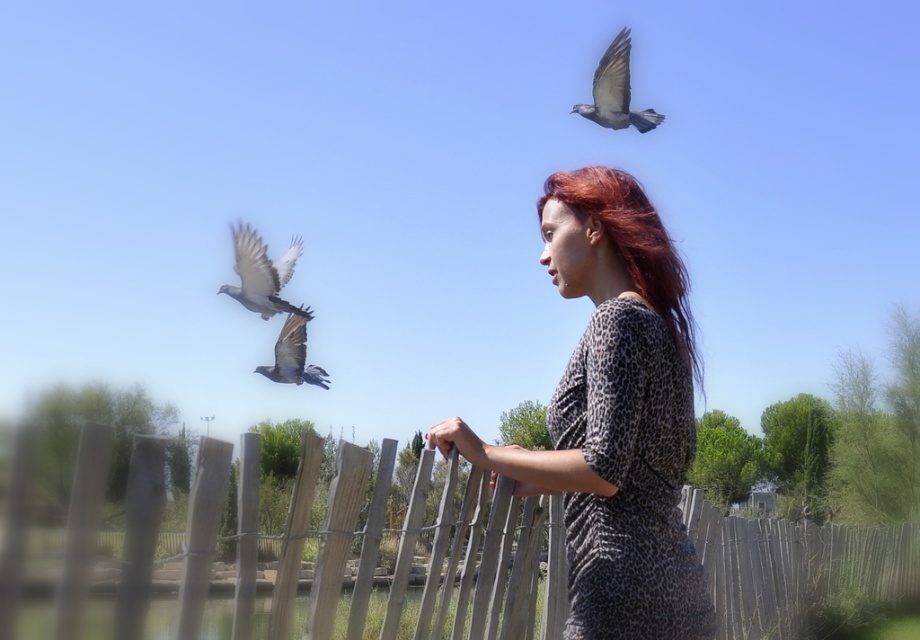
Can you confirm if leopard print dress at center is bigger than shiny red hair at center?

Yes, leopard print dress at center is bigger than shiny red hair at center.

Which of these two, leopard print dress at center or shiny red hair at center, stands taller?

With more height is leopard print dress at center.

Between point (591, 515) and point (548, 189), which one is positioned behind?

The point (548, 189) is behind.

This screenshot has width=920, height=640. I want to click on leopard print dress at center, so 614,416.

Is leopard print fabric dress at center to the left of shiny red hair at center from the viewer's perspective?

Incorrect, leopard print fabric dress at center is not on the left side of shiny red hair at center.

Who is taller, leopard print fabric dress at center or shiny red hair at center?

Standing taller between the two is leopard print fabric dress at center.

Describe the element at coordinates (629, 481) in the screenshot. This screenshot has height=640, width=920. I see `leopard print fabric dress at center` at that location.

Locate an element on the screen. leopard print fabric dress at center is located at coordinates (629, 481).

Is point (757, 625) less distant than point (309, 312)?

No, it is behind (309, 312).

Is wooden fence at center positioned at the back of gray feathered bird at upper left?

That is False.

Which is in front, point (445, 531) or point (261, 252)?

Point (445, 531) is more forward.

The image size is (920, 640). What are the coordinates of `wooden fence at center` in the screenshot? It's located at (794, 566).